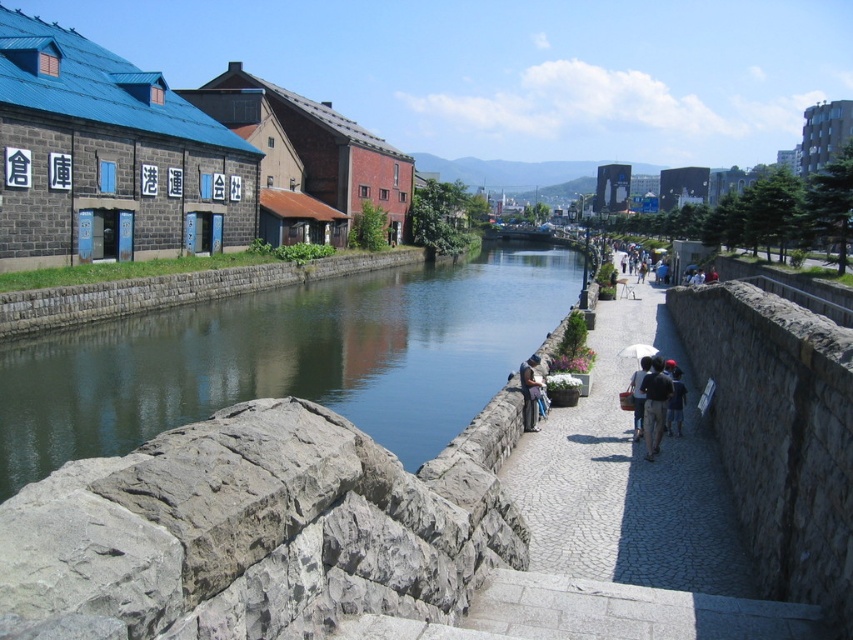
You are a tourist carrying a black fabric backpack at lower center and holding a matte black umbrella at center. You want to place both items on the ground next to you. Which item will require more vertical space when placed upright?

The black fabric backpack at lower center is taller than the matte black umbrella at center, so it will require more vertical space when placed upright.

You are a delivery person carrying a package and need to place it on the ground between the black fabric backpack at lower center and the matte black umbrella at center. The package is 18 inches long. Is there enough space between them to place the package without moving either item?

The distance between the black fabric backpack at lower center and the matte black umbrella at center is 37.25 inches. Since the package is 18 inches long, there is sufficient space to place it between them without moving either item.